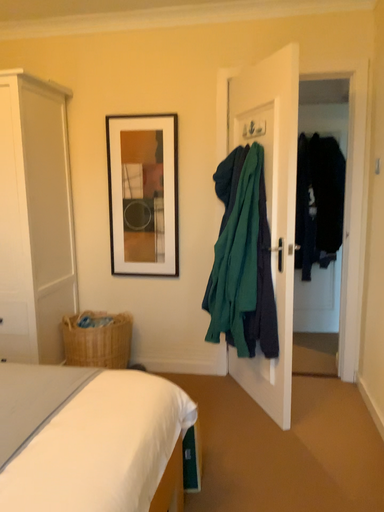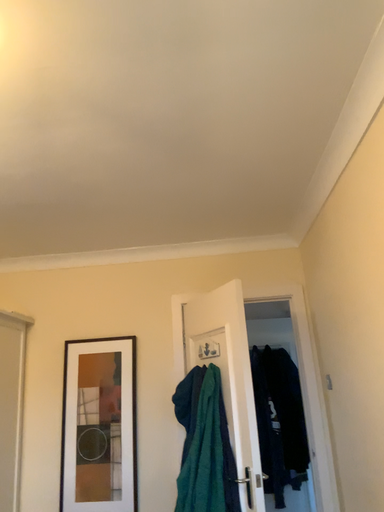
Question: Which way did the camera rotate in the video?

Choices:
 (A) rotated upward
 (B) rotated downward

Answer: (A)